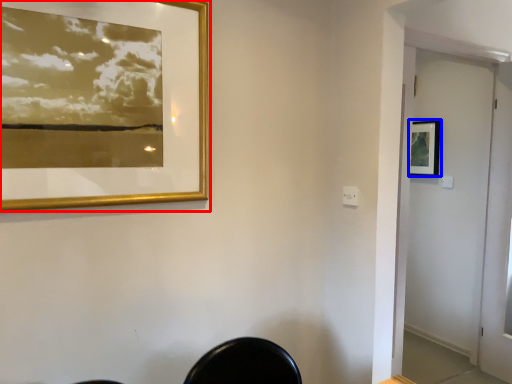
Question: Which object appears farthest to the camera in this image, picture frame (highlighted by a red box) or picture frame (highlighted by a blue box)?

Choices:
 (A) picture frame
 (B) picture frame

Answer: (B)